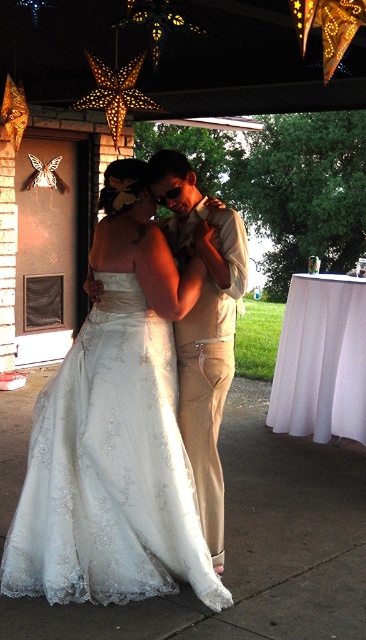
Measure the distance between white satin dress at center and tan fabric pants at center.

A distance of 12.14 inches exists between white satin dress at center and tan fabric pants at center.

Who is lower down, white satin dress at center or tan fabric pants at center?

white satin dress at center is below.

Between point (98, 570) and point (199, 476), which one is positioned in front?

Point (98, 570) is in front.

This screenshot has height=640, width=366. Find the location of `white satin dress at center`. white satin dress at center is located at coordinates (114, 433).